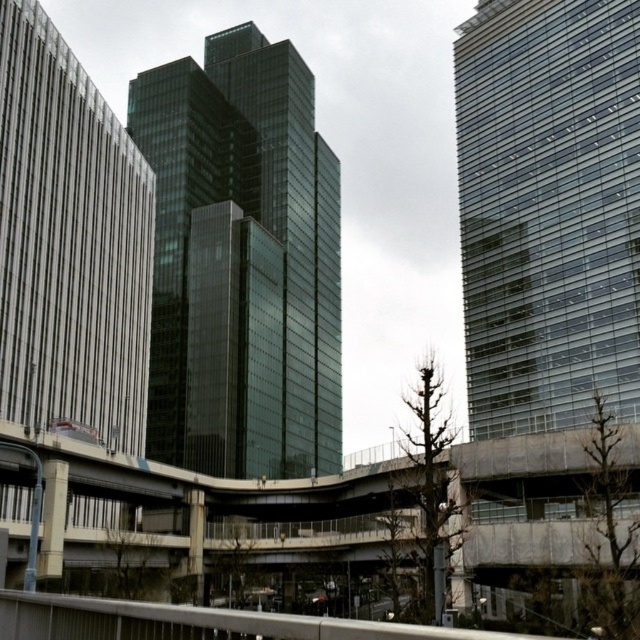
Which is more to the right, glassy black skyscraper at center or transparent glass tower at right?

transparent glass tower at right is more to the right.

Find the location of `glassy black skyscraper at center`. glassy black skyscraper at center is located at coordinates (241, 262).

Locate an element on the screen. glassy black skyscraper at center is located at coordinates (241, 262).